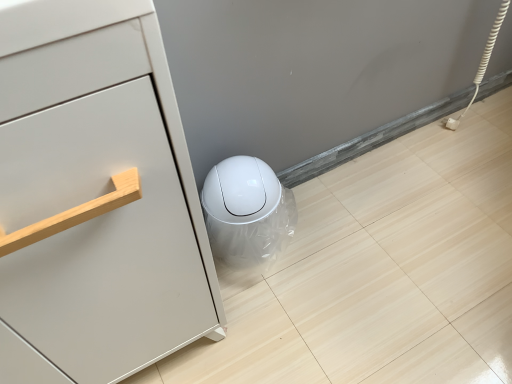
Measure the distance between point (246, 243) and camera.

Point (246, 243) is 1.05 meters away from camera.

What do you see at coordinates (247, 211) in the screenshot? I see `white glossy trash can at lower center` at bounding box center [247, 211].

Find the location of a particular element. The width and height of the screenshot is (512, 384). white glossy trash can at lower center is located at coordinates (247, 211).

Describe the element at coordinates (96, 197) in the screenshot. I see `matte white cabinet at left` at that location.

In order to face matte white cabinet at left, should I rotate leftwards or rightwards?

Turn left approximately 27.813 degrees to face it.

The image size is (512, 384). I want to click on matte white cabinet at left, so click(96, 197).

Where is `white glossy trash can at lower center`? The width and height of the screenshot is (512, 384). white glossy trash can at lower center is located at coordinates (247, 211).

Which is more to the left, white glossy trash can at lower center or matte white cabinet at left?

Positioned to the left is matte white cabinet at left.

Which object is closer to the camera taking this photo, white glossy trash can at lower center or matte white cabinet at left?

matte white cabinet at left is closer to the camera.

Does point (259, 201) appear closer or farther from the camera than point (196, 313)?

Point (259, 201) is positioned farther from the camera compared to point (196, 313).

From the image's perspective, between white glossy trash can at lower center and matte white cabinet at left, who is located below?

From the image's view, matte white cabinet at left is below.

From a real-world perspective, is white glossy trash can at lower center above or below matte white cabinet at left?

Clearly, from a real-world perspective, white glossy trash can at lower center is below matte white cabinet at left.

Is white glossy trash can at lower center wider or thinner than matte white cabinet at left?

Clearly, white glossy trash can at lower center has less width compared to matte white cabinet at left.

Between white glossy trash can at lower center and matte white cabinet at left, which one has less height?

With less height is white glossy trash can at lower center.

Which of these two, white glossy trash can at lower center or matte white cabinet at left, is smaller?

With smaller size is white glossy trash can at lower center.

Would you say white glossy trash can at lower center is inside or outside matte white cabinet at left?

white glossy trash can at lower center cannot be found inside matte white cabinet at left.

Is white glossy trash can at lower center not close to matte white cabinet at left?

No, white glossy trash can at lower center is not far away from matte white cabinet at left.

Is white glossy trash can at lower center oriented towards matte white cabinet at left?

No, white glossy trash can at lower center is not oriented towards matte white cabinet at left.

Measure the distance from white glossy trash can at lower center to matte white cabinet at left.

They are 13.91 inches apart.

This screenshot has height=384, width=512. What are the coordinates of `chest of drawers below the white glossy trash can at lower center (from the image's perspective)` in the screenshot? It's located at (96, 197).

Considering the positions of objects matte white cabinet at left and white glossy trash can at lower center in the image provided, who is more to the right, matte white cabinet at left or white glossy trash can at lower center?

Positioned to the right is white glossy trash can at lower center.

Does matte white cabinet at left come behind white glossy trash can at lower center?

No, it is in front of white glossy trash can at lower center.

Does point (192, 254) come in front of point (283, 190)?

Yes, point (192, 254) is closer to viewer.

From the image's perspective, relative to white glossy trash can at lower center, is matte white cabinet at left above or below?

matte white cabinet at left is situated lower than white glossy trash can at lower center in the image.

From a real-world perspective, relative to white glossy trash can at lower center, is matte white cabinet at left vertically above or below?

A: matte white cabinet at left is above white glossy trash can at lower center.

Does matte white cabinet at left have a greater width compared to white glossy trash can at lower center?

Correct, the width of matte white cabinet at left exceeds that of white glossy trash can at lower center.

From their relative heights in the image, would you say matte white cabinet at left is taller or shorter than white glossy trash can at lower center?

In the image, matte white cabinet at left appears to be taller than white glossy trash can at lower center.

Based on their sizes in the image, would you say matte white cabinet at left is bigger or smaller than white glossy trash can at lower center?

matte white cabinet at left is bigger than white glossy trash can at lower center.

Is matte white cabinet at left not inside white glossy trash can at lower center?

Yes.

Are matte white cabinet at left and white glossy trash can at lower center beside each other?

No.

Is matte white cabinet at left aimed at white glossy trash can at lower center?

No, matte white cabinet at left does not turn towards white glossy trash can at lower center.

Locate an element on the screen. chest of drawers in front of the white glossy trash can at lower center is located at coordinates (96, 197).

Locate an element on the screen. chest of drawers in front of the white glossy trash can at lower center is located at coordinates (96, 197).

Locate an element on the screen. porcelain that is on the right side of matte white cabinet at left is located at coordinates (247, 211).